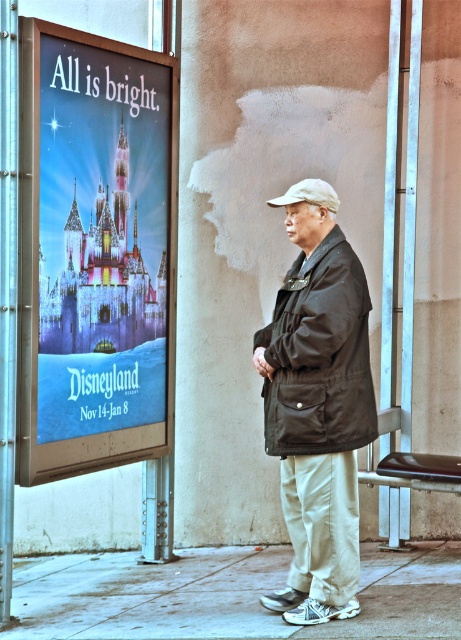
Measure the distance between gray concrete pavement at lower center and black matte jacket at center.

gray concrete pavement at lower center and black matte jacket at center are 4.32 feet apart from each other.

Does gray concrete pavement at lower center appear under black matte jacket at center?

Indeed, gray concrete pavement at lower center is positioned under black matte jacket at center.

Does point (24, 570) come farther from viewer compared to point (301, 273)?

That is True.

Locate an element on the screen. gray concrete pavement at lower center is located at coordinates (228, 595).

Measure the distance between matte plastic poster at left and camera.

matte plastic poster at left and camera are 7.08 meters apart.

Identify the location of matte plastic poster at left. (94, 250).

Image resolution: width=461 pixels, height=640 pixels. I want to click on matte plastic poster at left, so click(94, 250).

How much distance is there between matte plastic poster at left and gray concrete pavement at lower center?

4.72 feet

Is the position of matte plastic poster at left more distant than that of gray concrete pavement at lower center?

Yes, matte plastic poster at left is behind gray concrete pavement at lower center.

Does point (155, 186) come behind point (448, 589)?

Yes, it is.

This screenshot has width=461, height=640. Identify the location of matte plastic poster at left. (94, 250).